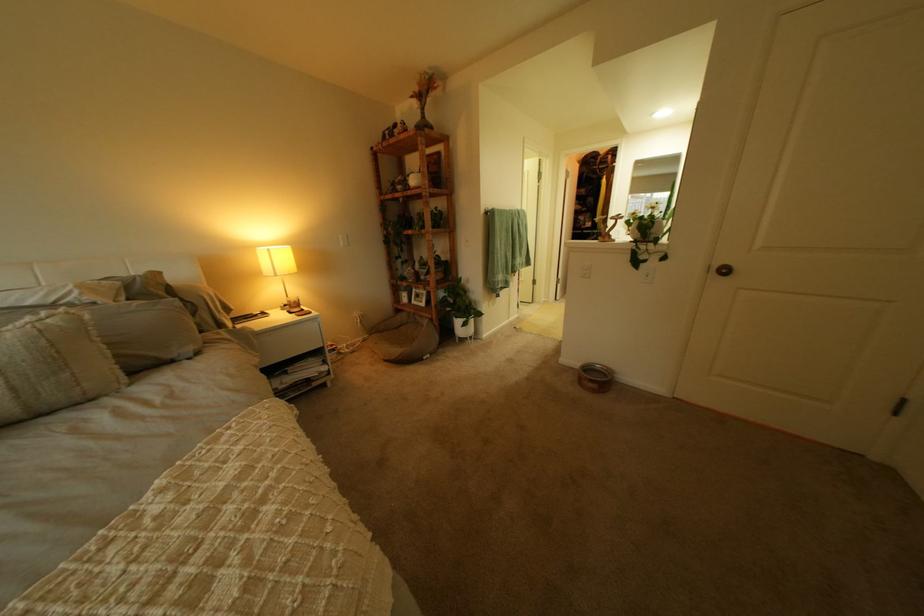
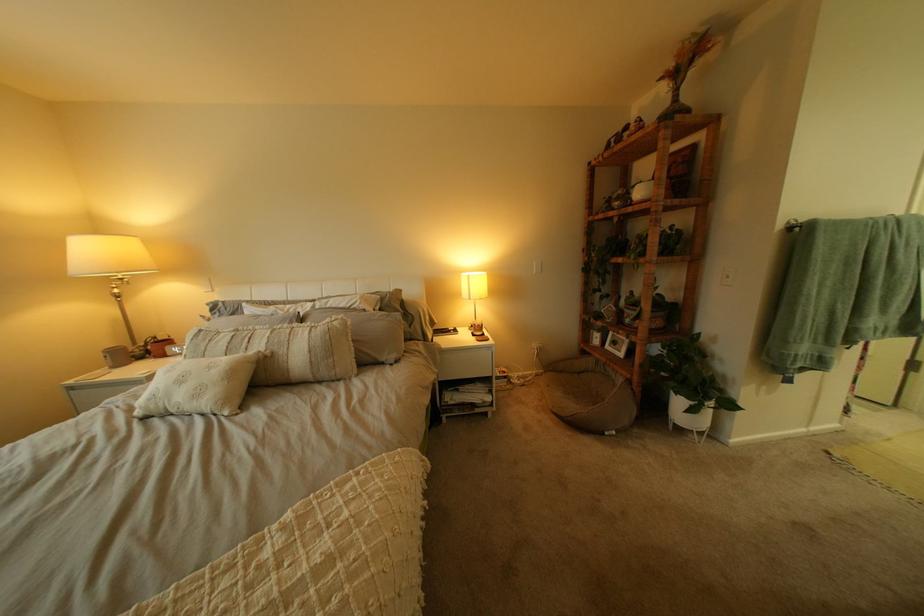
In the second image, find the point that corresponds to (x=427, y=99) in the first image.

(675, 81)